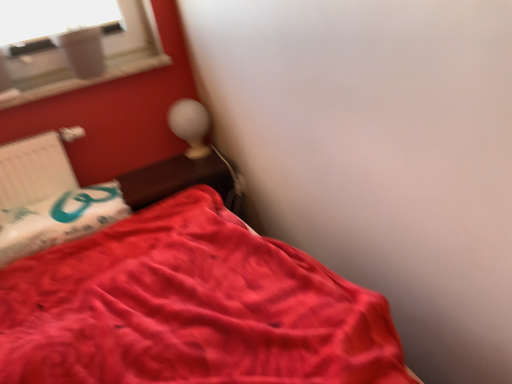
This screenshot has height=384, width=512. In order to click on free space in front of matte white table lamp at upper center in this screenshot , I will do `click(195, 171)`.